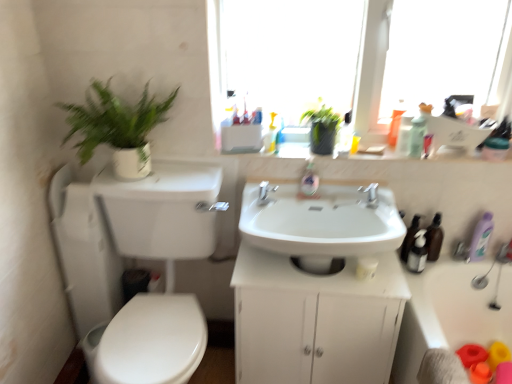
Where is `free region on the left part of yellow plastic bottle at upper center, placed as the sixth toiletry when sorted from right to left`? free region on the left part of yellow plastic bottle at upper center, placed as the sixth toiletry when sorted from right to left is located at coordinates (312, 151).